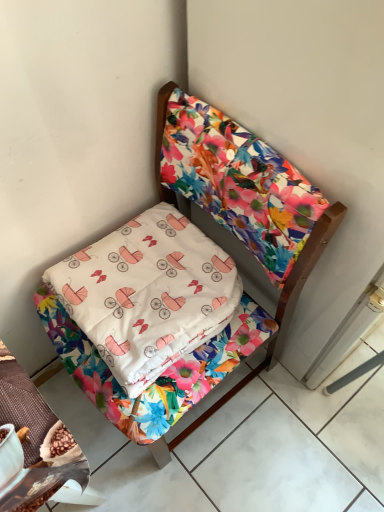
At what (x,y) coordinates should I click in order to perform the action: click on spots to the right of floral fabric bed at upper right. Please return your answer as a coordinate pair (x, y). This screenshot has height=512, width=384. Looking at the image, I should click on (305, 423).